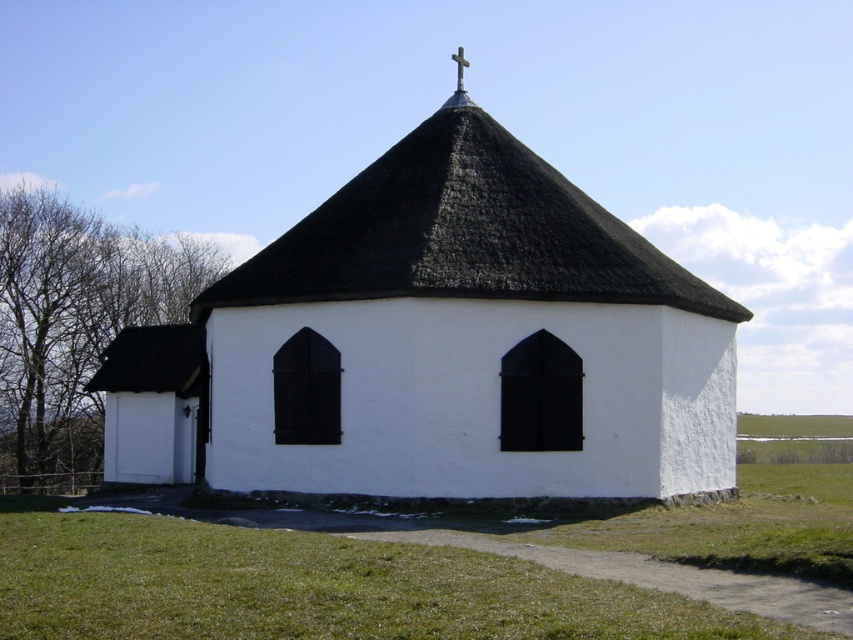
You are a drone operator who needs to capture aerial footage of the white matte church at center and the green grass at lower center. Your drone has a camera with a maximum zoom range of 10 meters. Can you capture both objects in a single shot without moving the drone?

The white matte church at center and green grass at lower center are 8.61 meters apart from each other. Since the drone camera has a maximum zoom range of 10 meters, which is greater than the distance between them, you can capture both objects in a single shot without moving the drone.

You are an architect designing a new church and want to ensure the cross on the roof is visible from a distance. Which cross, the metallic cross at upper center or the wooden cross at upper center, would you choose based on their height?

The metallic cross at upper center has a greater height compared to the wooden cross at upper center, so choosing the metallic cross at upper center would ensure better visibility from a distance.

You are standing in a field and see the white matte church at center and the green grass at lower center. Which object is positioned to the right side of the other?

The white matte church at center is to the right of green grass at lower center.